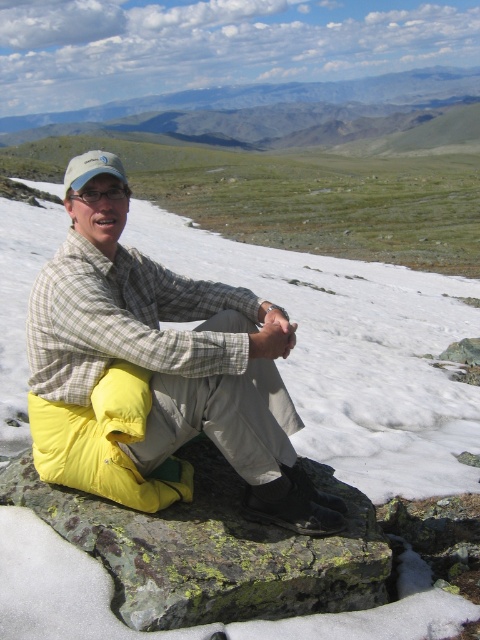
How distant is yellow fabric sleeping pad at center from green grassy plain at upper center?

118.27 meters

Does yellow fabric sleeping pad at center appear under green grassy plain at upper center?

Correct, yellow fabric sleeping pad at center is located below green grassy plain at upper center.

What do you see at coordinates (157, 369) in the screenshot? The height and width of the screenshot is (640, 480). I see `yellow fabric sleeping pad at center` at bounding box center [157, 369].

Locate an element on the screen. Image resolution: width=480 pixels, height=640 pixels. yellow fabric sleeping pad at center is located at coordinates (157, 369).

Based on the photo, does yellow fabric sleeping pad at center have a greater width compared to green mossy rock at center?

No.

Which is below, yellow fabric sleeping pad at center or green mossy rock at center?

green mossy rock at center is below.

Where is `yellow fabric sleeping pad at center`? The image size is (480, 640). yellow fabric sleeping pad at center is located at coordinates (157, 369).

Where is `yellow fabric sleeping pad at center`? Image resolution: width=480 pixels, height=640 pixels. yellow fabric sleeping pad at center is located at coordinates (157, 369).

Does green mossy rock at center have a larger size compared to green grassy plain at upper center?

No, green mossy rock at center is not bigger than green grassy plain at upper center.

Who is more distant from viewer, (206,458) or (399,84)?

The point (399,84) is behind.

Identify the location of green mossy rock at center. The image size is (480, 640). (214, 548).